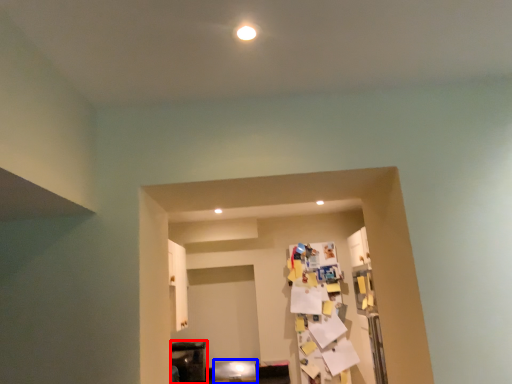
Question: Which of the following is the closest to the observer, furniture (highlighted by a red box) or furniture (highlighted by a blue box)?

Choices:
 (A) furniture
 (B) furniture

Answer: (B)